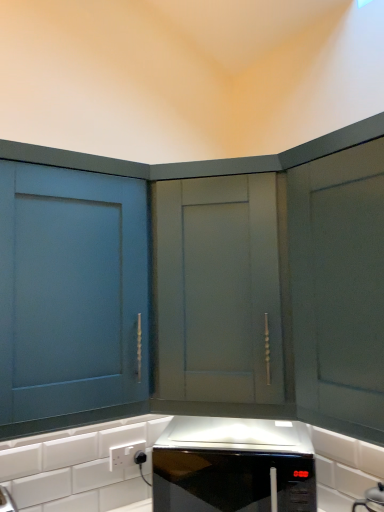
Question: In terms of width, does matte blue cabinet at left, which is counted as the 2th cabinetry, starting from the right, look wider or thinner when compared to black glossy microwave at center?

Choices:
 (A) thin
 (B) wide

Answer: (A)

Question: Is matte blue cabinet at left, which ranks as the first cabinetry in left-to-right order, to the left or to the right of black glossy microwave at center in the image?

Choices:
 (A) right
 (B) left

Answer: (B)

Question: Estimate the real-world distances between objects in this image. Which object is closer to the matte gray cabinet at center, which appears as the 1th cabinetry when viewed from the right?

Choices:
 (A) matte blue cabinet at left, which ranks as the first cabinetry in left-to-right order
 (B) black glossy microwave at center
 (C) white plastic electric outlet at lower center

Answer: (A)

Question: Estimate the real-world distances between objects in this image. Which object is farther from the white plastic electric outlet at lower center?

Choices:
 (A) matte blue cabinet at left, which ranks as the first cabinetry in left-to-right order
 (B) black glossy microwave at center
 (C) matte gray cabinet at center, which appears as the 1th cabinetry when viewed from the right

Answer: (C)